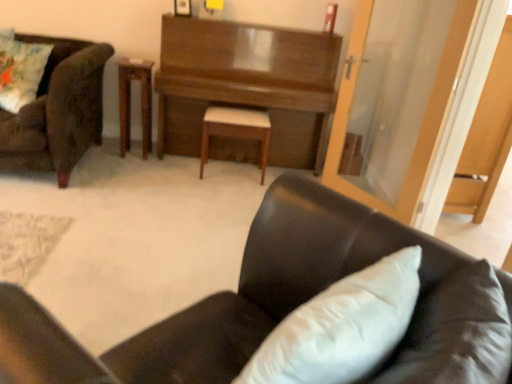
Locate an element on the screen. free point below wooden table at center (from a real-world perspective) is located at coordinates (133, 157).